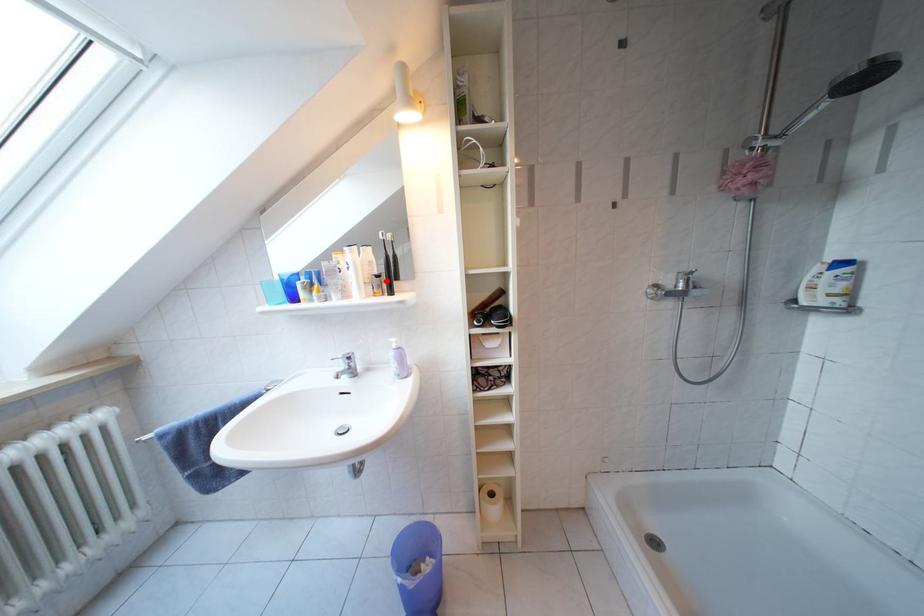
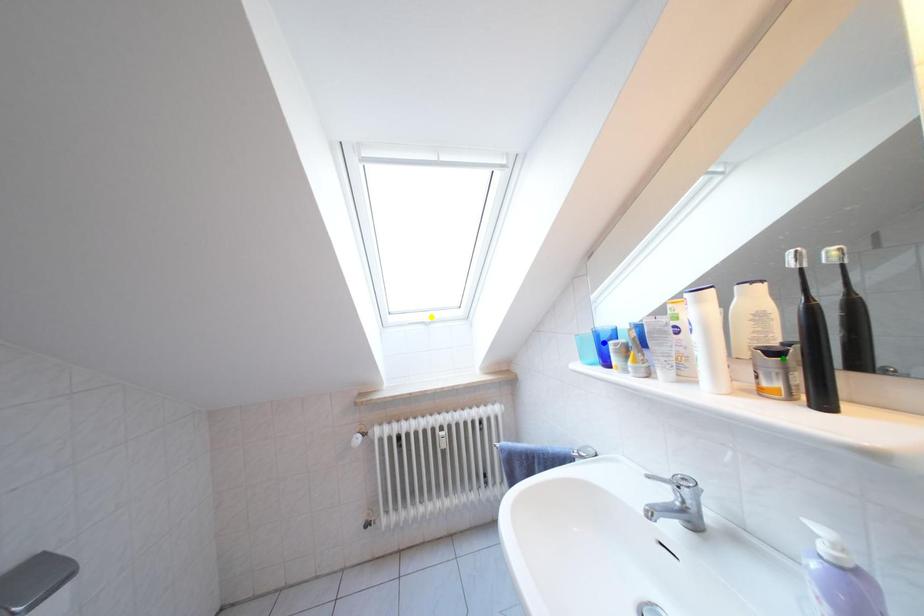
Question: I am providing you with two images of the same scene from different viewpoints. A red point is marked on the first image. You are given multiple points on the second image. Which point in image 2 is actually the same real-world point as the red point in image 1?

Choices:
 (A) yellow point
 (B) green point
 (C) blue point

Answer: (B)